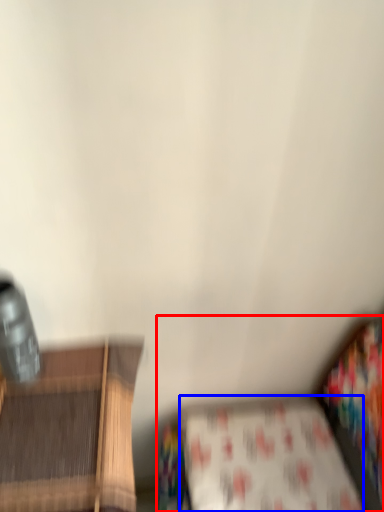
Question: Among these objects, which one is farthest to the camera, studio couch (highlighted by a red box) or sheet (highlighted by a blue box)?

Choices:
 (A) studio couch
 (B) sheet

Answer: (B)